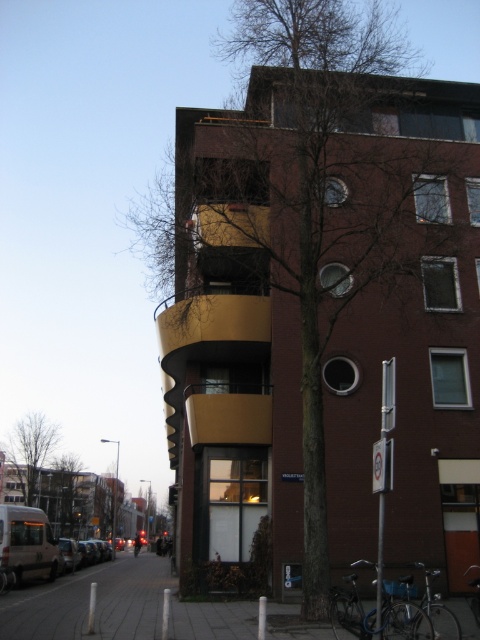
You are standing at the entrance of the building and want to take a photo of the brown textured tree at center. Which direction should you face to capture the tree in the frame?

The brown textured tree at center is located at point coordinates (322, 300), so you should face towards the center of the image to capture it in the frame.

You are standing on the sidewalk in front of the building and notice the bare branches at left and the green leafy tree at center. Which tree is closer to you?

The bare branches at left are closer to the viewer than the green leafy tree at center.

You are a bird looking for a place to perch. You see a brown textured tree at center and a green leafy tree at center. Which tree is higher up in the sky?

The brown textured tree at center is above the green leafy tree at center, so the brown textured tree at center is higher up in the sky.